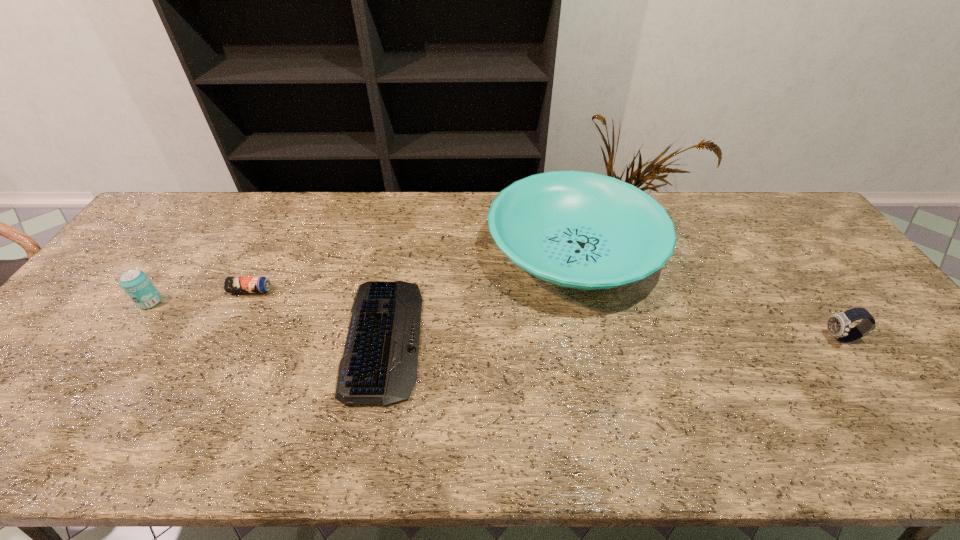
Where is `vacant space situated on the right of the left beer can`? The width and height of the screenshot is (960, 540). vacant space situated on the right of the left beer can is located at coordinates (241, 302).

Locate an element on the screen. The width and height of the screenshot is (960, 540). free region located 0.340m on the face of the watch is located at coordinates (690, 339).

Locate an element on the screen. free point located 0.090m on the face of the watch is located at coordinates (788, 339).

Locate an element on the screen. free space located on the face of the watch is located at coordinates (804, 339).

Image resolution: width=960 pixels, height=540 pixels. In order to click on free space located on the back of the shorter beer can in this screenshot , I will do `click(290, 211)`.

Locate an element on the screen. The height and width of the screenshot is (540, 960). free spot located 0.170m on the left of the computer keyboard is located at coordinates (279, 338).

I want to click on object positioned at the far edge, so click(x=582, y=230).

Find the location of a particular element. object present at the left edge is located at coordinates (136, 284).

Image resolution: width=960 pixels, height=540 pixels. Find the location of `object positioned at the right edge`. object positioned at the right edge is located at coordinates (838, 324).

The image size is (960, 540). Find the location of `free spot at the far edge of the desktop`. free spot at the far edge of the desktop is located at coordinates (725, 221).